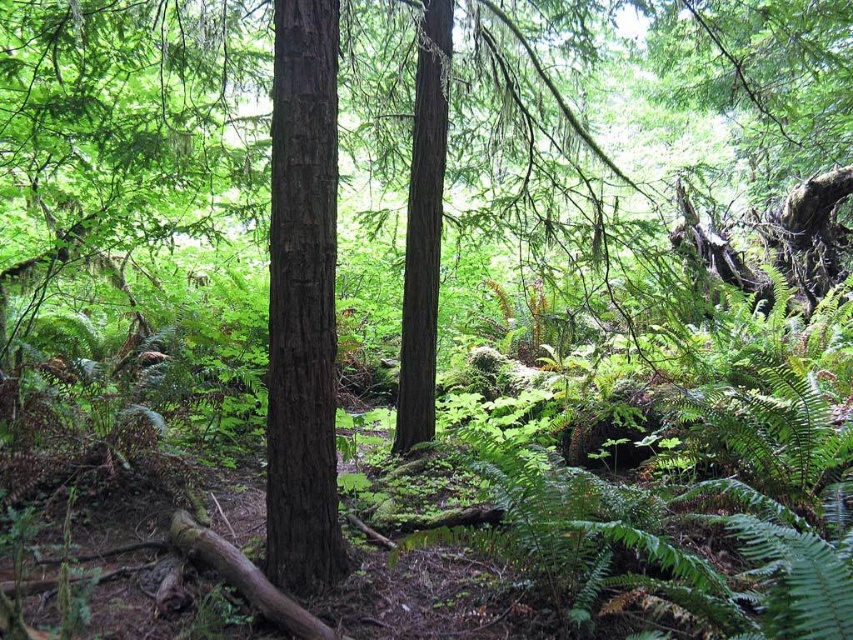
Question: Does dark brown wood tree at center appear on the left side of smooth brown tree trunk at center?

Choices:
 (A) no
 (B) yes

Answer: (B)

Question: Which of the following is the closest to the observer?

Choices:
 (A) (283, 81)
 (B) (410, 257)

Answer: (A)

Question: In this image, where is dark brown wood tree at center located relative to smooth brown tree trunk at center?

Choices:
 (A) right
 (B) left

Answer: (B)

Question: Does dark brown wood tree at center appear on the left side of smooth brown tree trunk at center?

Choices:
 (A) yes
 (B) no

Answer: (A)